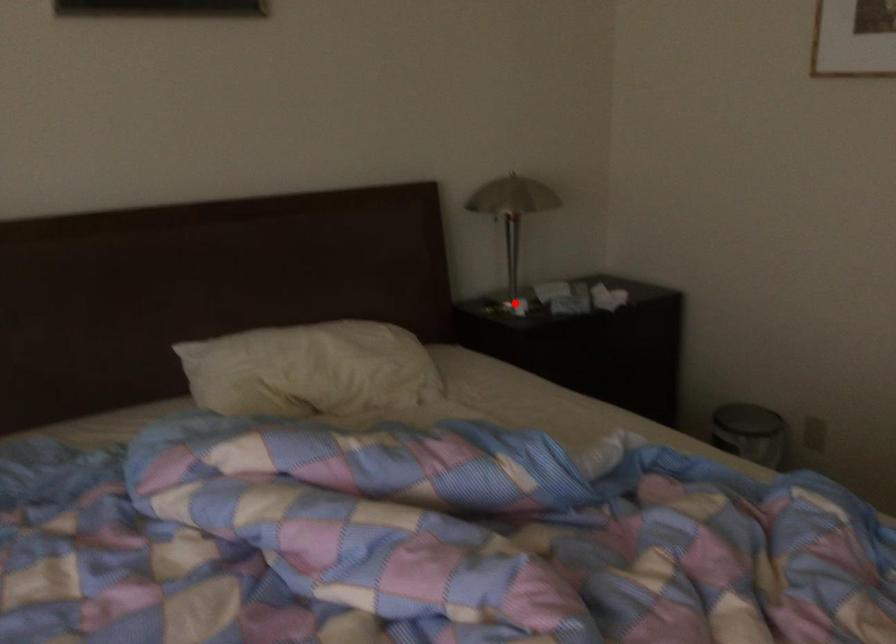
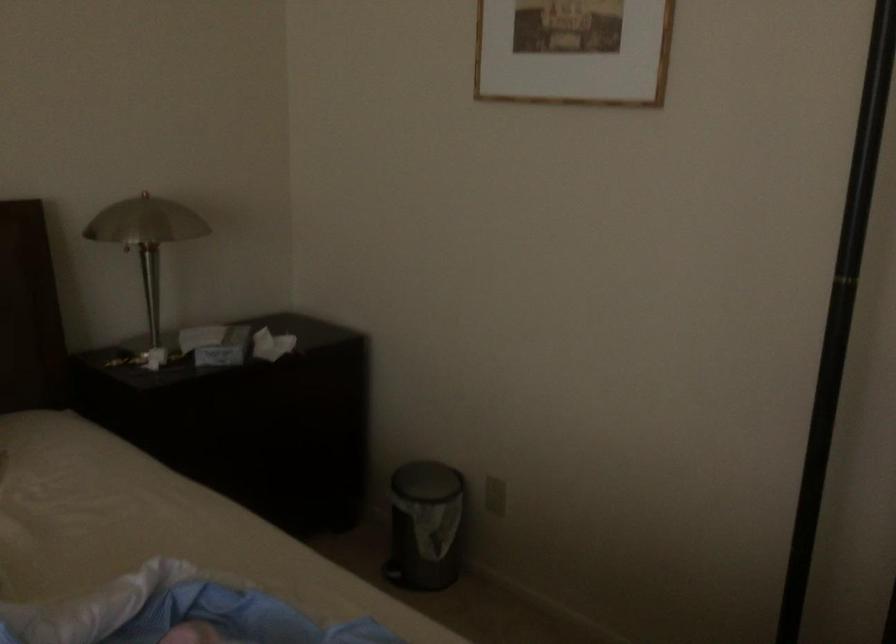
Question: A red point is marked in image1. In image2, is the corresponding 3D point closer to the camera or farther? Reply with the corresponding letter.

Choices:
 (A) The corresponding 3D point is closer.
 (B) The corresponding 3D point is farther.

Answer: (A)